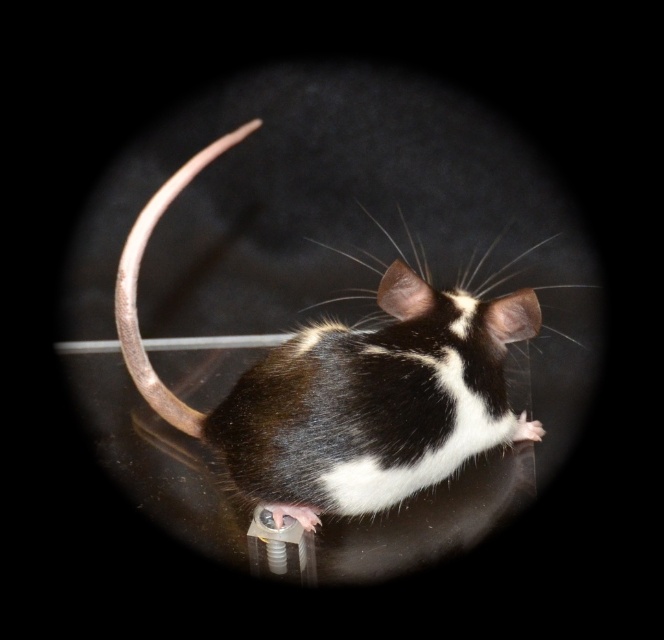
Does black fur mouse at center appear over metallic tail at center?

No, black fur mouse at center is not above metallic tail at center.

Can you confirm if black fur mouse at center is bigger than metallic tail at center?

Yes.

Is point (270, 458) closer to camera compared to point (133, 342)?

Yes.

Identify the location of black fur mouse at center. (347, 387).